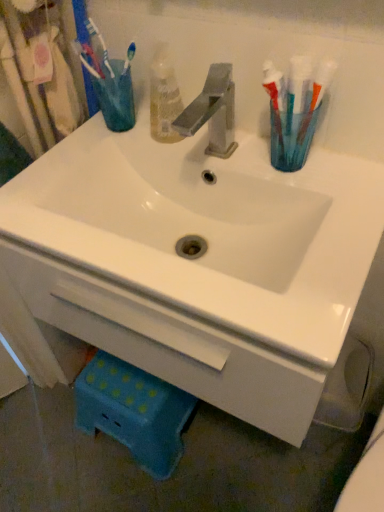
In order to face translucent plastic cup at upper left, which is counted as the 2th turquoise, starting from the front, should I rotate leftwards or rightwards?

A 9.401 degree turn to the left will do.

Identify the location of translucent plastic toothbrush holder at upper right, which appears as the first turquoise when ordered from the bottom. The image size is (384, 512). (293, 135).

Image resolution: width=384 pixels, height=512 pixels. Identify the location of white glossy sink at center. (211, 229).

At what (x,y) coordinates should I click in order to perform the action: click on translucent plastic cup at upper left, which is counted as the 1th turquoise, starting from the back. Please return your answer as a coordinate pair (x, y). The width and height of the screenshot is (384, 512). Looking at the image, I should click on (115, 95).

From a real-world perspective, between translucent plastic toothbrush holder at upper right, positioned as the second turquoise in top-to-bottom order, and white glossy sink at center, who is vertically lower?

white glossy sink at center.

From the image's perspective, which is below, translucent plastic toothbrush holder at upper right, the first turquoise positioned from the right, or white glossy sink at center?

white glossy sink at center, from the image's perspective.

Identify the location of turquoise to the right of white glossy sink at center. (293, 135).

Can you tell me how much translucent plastic toothbrush holder at upper right, which ranks as the 2th turquoise in back-to-front order, and white glossy sink at center differ in facing direction?

They differ by 0.000486 degrees in their facing directions.

Can you tell me how much translucent plastic toothbrush holder at upper right, which is the second turquoise from left to right, and translucent plastic cup at upper left, which is counted as the 1th turquoise, starting from the back, differ in facing direction?

There is a 0.000612-degree angle between the facing directions of translucent plastic toothbrush holder at upper right, which is the second turquoise from left to right, and translucent plastic cup at upper left, which is counted as the 1th turquoise, starting from the back.

Is translucent plastic toothbrush holder at upper right, which is counted as the first turquoise, starting from the front, inside the boundaries of translucent plastic cup at upper left, which is the 1th turquoise in left-to-right order, or outside?

translucent plastic toothbrush holder at upper right, which is counted as the first turquoise, starting from the front, exists outside the volume of translucent plastic cup at upper left, which is the 1th turquoise in left-to-right order.

Which object is thinner, translucent plastic toothbrush holder at upper right, which is counted as the first turquoise, starting from the front, or translucent plastic cup at upper left, which is counted as the 2th turquoise, starting from the front?

translucent plastic toothbrush holder at upper right, which is counted as the first turquoise, starting from the front, is thinner.

Is point (83, 58) closer or farther from the camera than point (278, 121)?

Point (83, 58).

From the image's perspective, between brushed metal toothbrush at upper left and translucent plastic toothbrush holder at upper right, which is the second turquoise from left to right, which one is located above?

From the image's view, brushed metal toothbrush at upper left is above.

From their relative heights in the image, would you say brushed metal toothbrush at upper left is taller or shorter than translucent plastic toothbrush holder at upper right, the first turquoise positioned from the right?

brushed metal toothbrush at upper left is taller than translucent plastic toothbrush holder at upper right, the first turquoise positioned from the right.

Is brushed metal toothbrush at upper left positioned with its back to translucent plastic toothbrush holder at upper right, the first turquoise positioned from the right?

brushed metal toothbrush at upper left is not turned away from translucent plastic toothbrush holder at upper right, the first turquoise positioned from the right.

From the image's perspective, is white glossy sink at center positioned above or below translucent plastic cup at upper left, arranged as the 1th turquoise when viewed from the top?

From the image's perspective, white glossy sink at center appears below translucent plastic cup at upper left, arranged as the 1th turquoise when viewed from the top.

Considering the positions of objects white glossy sink at center and translucent plastic cup at upper left, which is counted as the 2th turquoise, starting from the front, in the image provided, who is more to the right, white glossy sink at center or translucent plastic cup at upper left, which is counted as the 2th turquoise, starting from the front,?

From the viewer's perspective, white glossy sink at center appears more on the right side.

Which of these two, white glossy sink at center or translucent plastic cup at upper left, which is the second turquoise in right-to-left order, stands shorter?

translucent plastic cup at upper left, which is the second turquoise in right-to-left order.

Is brushed metal toothbrush at upper left completely or partially outside of translucent plastic cup at upper left, which is counted as the 1th turquoise, starting from the back?

That's incorrect, brushed metal toothbrush at upper left is not completely outside translucent plastic cup at upper left, which is counted as the 1th turquoise, starting from the back.

Is brushed metal toothbrush at upper left oriented away from translucent plastic cup at upper left, the 2th turquoise ordered from the bottom?

Yes, brushed metal toothbrush at upper left is facing away from translucent plastic cup at upper left, the 2th turquoise ordered from the bottom.

Is brushed metal toothbrush at upper left in front of translucent plastic cup at upper left, which is the second turquoise in right-to-left order?

Yes, it is.

How many degrees apart are the facing directions of brushed metal toothbrush at upper left and translucent plastic cup at upper left, arranged as the 1th turquoise when viewed from the top?

2.28 degrees separate the facing orientations of brushed metal toothbrush at upper left and translucent plastic cup at upper left, arranged as the 1th turquoise when viewed from the top.

Can we say white glossy sink at center lies outside translucent plastic toothbrush holder at upper right, which is the second turquoise from left to right?

Yes, white glossy sink at center is located beyond the bounds of translucent plastic toothbrush holder at upper right, which is the second turquoise from left to right.

In the image, there is a translucent plastic toothbrush holder at upper right, which is the second turquoise from left to right. Where is `sink below it (from the image's perspective)`? This screenshot has height=512, width=384. sink below it (from the image's perspective) is located at coordinates (211, 229).

Based on the photo, based on their sizes in the image, would you say white glossy sink at center is bigger or smaller than translucent plastic toothbrush holder at upper right, positioned as the second turquoise in top-to-bottom order?

white glossy sink at center is bigger than translucent plastic toothbrush holder at upper right, positioned as the second turquoise in top-to-bottom order.

Can you tell me how much white glossy sink at center and translucent plastic toothbrush holder at upper right, which is counted as the first turquoise, starting from the front, differ in facing direction?

0.000486 degrees separate the facing orientations of white glossy sink at center and translucent plastic toothbrush holder at upper right, which is counted as the first turquoise, starting from the front.

Which is farther from the camera, (289, 110) or (91, 66)?

The point (91, 66) is farther.

Does translucent plastic toothbrush holder at upper right, which is the second turquoise from left to right, contain brushed metal toothbrush at upper left?

No, translucent plastic toothbrush holder at upper right, which is the second turquoise from left to right, does not contain brushed metal toothbrush at upper left.

Based on their sizes in the image, would you say translucent plastic toothbrush holder at upper right, which ranks as the 2th turquoise in back-to-front order, is bigger or smaller than brushed metal toothbrush at upper left?

translucent plastic toothbrush holder at upper right, which ranks as the 2th turquoise in back-to-front order, is bigger than brushed metal toothbrush at upper left.

From a real-world perspective, who is located higher, translucent plastic toothbrush holder at upper right, which is the second turquoise from left to right, or brushed metal toothbrush at upper left?

brushed metal toothbrush at upper left is physically above.

Identify the location of turquoise on the right of white glossy sink at center. (293, 135).

Identify the location of turquoise below the translucent plastic cup at upper left, the 2th turquoise ordered from the bottom (from a real-world perspective). The image size is (384, 512). (293, 135).

From the image, which object appears to be nearer to white glossy sink at center, translucent plastic toothbrush holder at upper right, which appears as the first turquoise when ordered from the bottom, or brushed metal toothbrush at upper left?

translucent plastic toothbrush holder at upper right, which appears as the first turquoise when ordered from the bottom.

Looking at the image, which one is located further to brushed metal toothbrush at upper left, white glossy sink at center or translucent plastic toothbrush holder at upper right, which appears as the first turquoise when ordered from the bottom?

translucent plastic toothbrush holder at upper right, which appears as the first turquoise when ordered from the bottom.

Estimate the real-world distances between objects in this image. Which object is further from translucent plastic cup at upper left, which is the second turquoise in right-to-left order, white glossy sink at center or translucent plastic toothbrush holder at upper right, which ranks as the 2th turquoise in back-to-front order?

translucent plastic toothbrush holder at upper right, which ranks as the 2th turquoise in back-to-front order, is positioned further to the anchor translucent plastic cup at upper left, which is the second turquoise in right-to-left order.

Based on their spatial positions, is brushed metal toothbrush at upper left or white glossy sink at center further from translucent plastic toothbrush holder at upper right, which appears as the first turquoise when ordered from the bottom?

Among the two, brushed metal toothbrush at upper left is located further to translucent plastic toothbrush holder at upper right, which appears as the first turquoise when ordered from the bottom.

Which object lies further to the anchor point translucent plastic cup at upper left, which is the 1th turquoise in left-to-right order, brushed metal toothbrush at upper left or white glossy sink at center?

white glossy sink at center lies further to translucent plastic cup at upper left, which is the 1th turquoise in left-to-right order, than the other object.

Looking at the image, which one is located further to translucent plastic toothbrush holder at upper right, which is counted as the first turquoise, starting from the front, translucent plastic cup at upper left, which is counted as the 1th turquoise, starting from the back, or white glossy sink at center?

Among the two, translucent plastic cup at upper left, which is counted as the 1th turquoise, starting from the back, is located further to translucent plastic toothbrush holder at upper right, which is counted as the first turquoise, starting from the front.

When comparing their distances from translucent plastic cup at upper left, which is counted as the 2th turquoise, starting from the front, does brushed metal toothbrush at upper left or translucent plastic toothbrush holder at upper right, which is counted as the first turquoise, starting from the front, seem closer?

The object closer to translucent plastic cup at upper left, which is counted as the 2th turquoise, starting from the front, is brushed metal toothbrush at upper left.

Looking at the image, which one is located further to brushed metal toothbrush at upper left, translucent plastic cup at upper left, which is the 1th turquoise in left-to-right order, or white glossy sink at center?

white glossy sink at center is positioned further to the anchor brushed metal toothbrush at upper left.

You are a GUI agent. You are given a task and a screenshot of the screen. Output one action in this format:
    pyautogui.click(x=<x>, y=<y>)
    Task: Click on the turquoise located between brushed metal toothbrush at upper left and translucent plastic toothbrush holder at upper right, which ranks as the 2th turquoise in back-to-front order, in the left-right direction
    This screenshot has height=512, width=384.
    Given the screenshot: What is the action you would take?
    pyautogui.click(x=115, y=95)

This screenshot has width=384, height=512. In order to click on turquoise between translucent plastic cup at upper left, arranged as the 1th turquoise when viewed from the top, and white glossy sink at center vertically in this screenshot , I will do `click(293, 135)`.